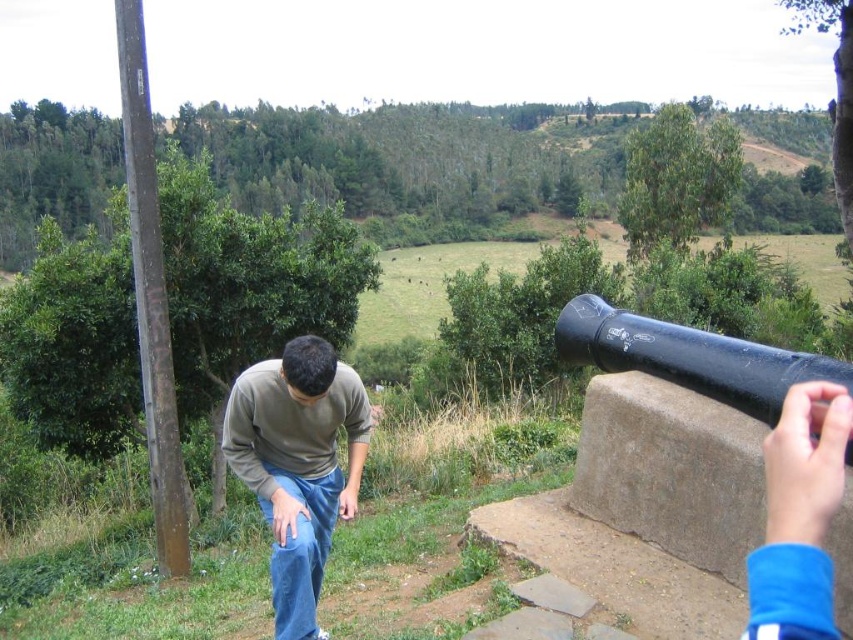
Question: Does matte green sweater at center appear over blue fabric hand at lower right?

Choices:
 (A) no
 (B) yes

Answer: (A)

Question: Which object is positioned farthest from the blue fabric hand at lower right?

Choices:
 (A) matte green sweater at center
 (B) black matte cannon at right

Answer: (B)

Question: Which point is farther to the camera?

Choices:
 (A) blue fabric hand at lower right
 (B) matte green sweater at center

Answer: (B)

Question: Does matte green sweater at center lie in front of black matte cannon at right?

Choices:
 (A) no
 (B) yes

Answer: (A)

Question: Which point is closer to the camera taking this photo?

Choices:
 (A) (323, 390)
 (B) (808, 476)

Answer: (B)

Question: Is matte green sweater at center smaller than blue fabric hand at lower right?

Choices:
 (A) yes
 (B) no

Answer: (B)